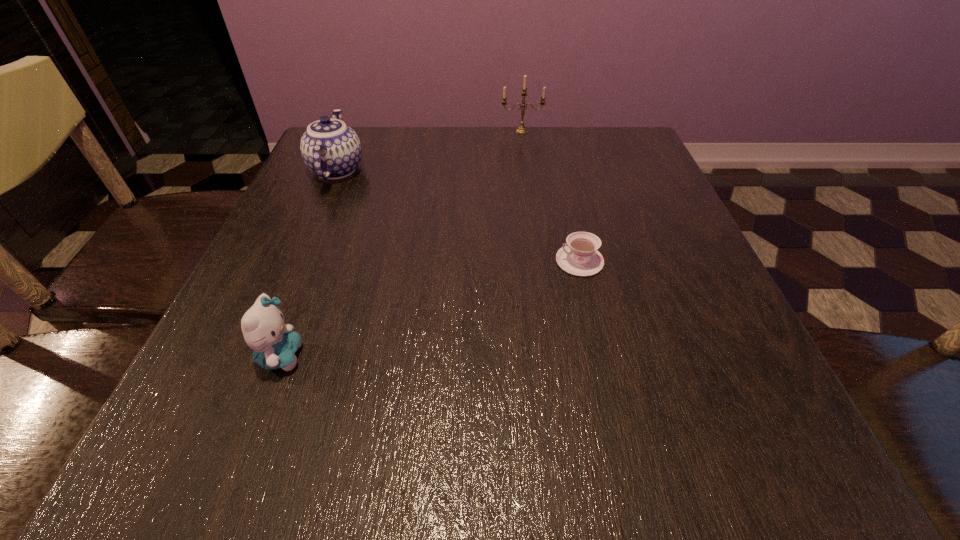
Image resolution: width=960 pixels, height=540 pixels. In order to click on the farthest object in this screenshot , I will do `click(521, 129)`.

I want to click on the second farthest object, so click(x=331, y=149).

At what (x,y) coordinates should I click in order to perform the action: click on the second shortest object. Please return your answer as a coordinate pair (x, y). Looking at the image, I should click on (274, 344).

Image resolution: width=960 pixels, height=540 pixels. What are the coordinates of `the nearest object` in the screenshot? It's located at (274, 344).

Identify the location of teacup. The width and height of the screenshot is (960, 540). 579,256.

Find the location of `the second nearest object`. the second nearest object is located at coordinates (579, 256).

Locate an element on the screen. free space located on the left of the candle is located at coordinates (461, 131).

This screenshot has height=540, width=960. Find the location of `vacant area located 0.110m at the spout of the chinaware`. vacant area located 0.110m at the spout of the chinaware is located at coordinates (356, 126).

Identify the location of free space located 0.290m on the face of the nearest object. 499,356.

Identify the location of vacant position located on the handle side of the shortest object. The image size is (960, 540). (512, 261).